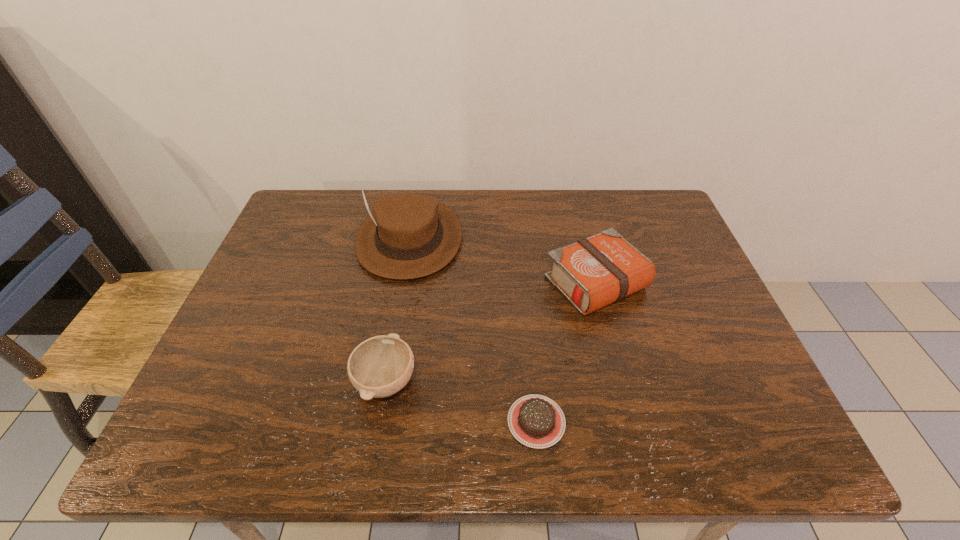
Where is `vacant region between the chocolate cake and the tallest object`? The height and width of the screenshot is (540, 960). vacant region between the chocolate cake and the tallest object is located at coordinates (473, 330).

Where is `unoccupied area between the shortest object and the bowl`? The width and height of the screenshot is (960, 540). unoccupied area between the shortest object and the bowl is located at coordinates (461, 401).

This screenshot has height=540, width=960. Find the location of `free space that is in between the rightmost object and the tallest object`. free space that is in between the rightmost object and the tallest object is located at coordinates (503, 261).

Locate an element on the screen. The width and height of the screenshot is (960, 540). free space between the rightmost object and the shortest object is located at coordinates (566, 352).

You are a GUI agent. You are given a task and a screenshot of the screen. Output one action in this format:
    pyautogui.click(x=<x>, y=<y>)
    Task: Click on the free space between the tallest object and the rightmost object
    
    Given the screenshot: What is the action you would take?
    pyautogui.click(x=503, y=261)

Find the location of a particular element. vacant space in between the tallest object and the bowl is located at coordinates (397, 310).

I want to click on free space between the second object from right to left and the rightmost object, so click(x=566, y=352).

Locate an element on the screen. The height and width of the screenshot is (540, 960). unoccupied area between the tallest object and the bowl is located at coordinates (397, 310).

This screenshot has height=540, width=960. What are the coordinates of `vacant space that is in between the third object from left to right and the tallest object` in the screenshot? It's located at coord(473,330).

Locate an element on the screen. object that is the third closest to the bowl is located at coordinates (593, 272).